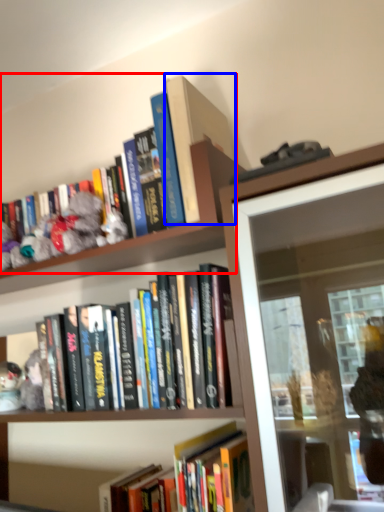
Question: Which object appears closest to the camera in this image, book (highlighted by a red box) or book (highlighted by a blue box)?

Choices:
 (A) book
 (B) book

Answer: (A)